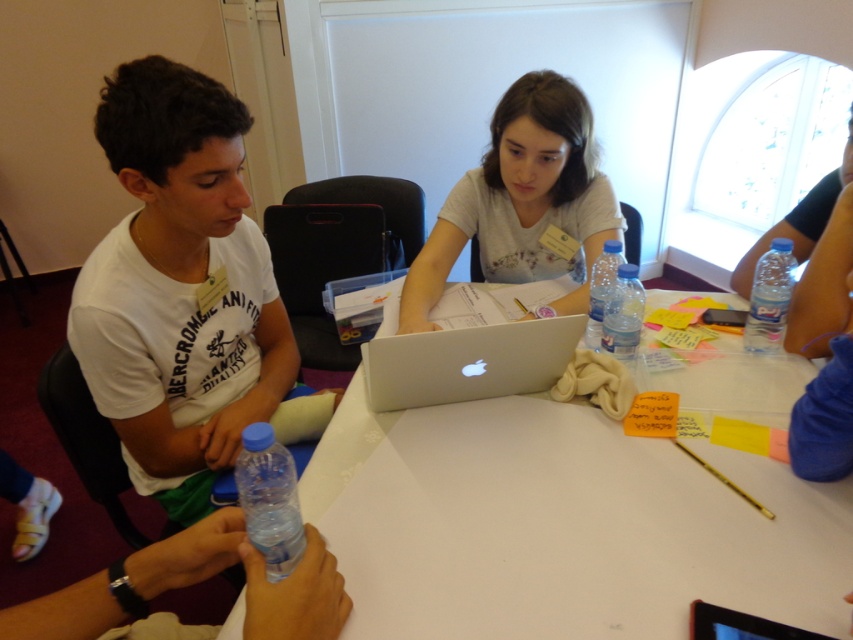
You are standing in front of the table where the collaborative activity is happening. There are two points marked on the table surface at coordinates point (753,280) and point (598,337). Which point is closer to you?

Point (753,280) is further to the viewer than point (598,337), so the point closer to you is point (598,337).

You are sitting at the table and want to reach for the blue plastic bottle at lower left without moving your chair. Can you do it easily if the clear plastic bottle at center is blocking your direct path?

The blue plastic bottle at lower left is below the clear plastic bottle at center, so it might be accessible if you can reach around or under the clear plastic bottle at center. However, this depends on your arm length and the space available between the bottles.